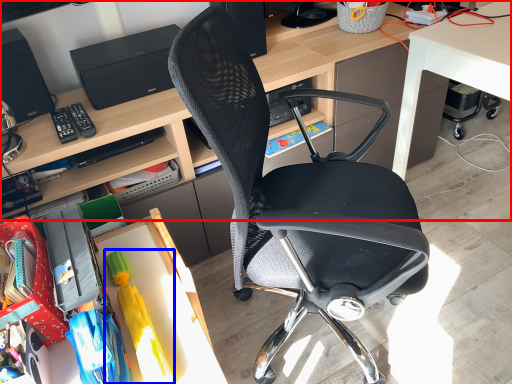
Question: Among these objects, which one is farthest to the camera, desk (highlighted by a red box) or toy (highlighted by a blue box)?

Choices:
 (A) desk
 (B) toy

Answer: (A)